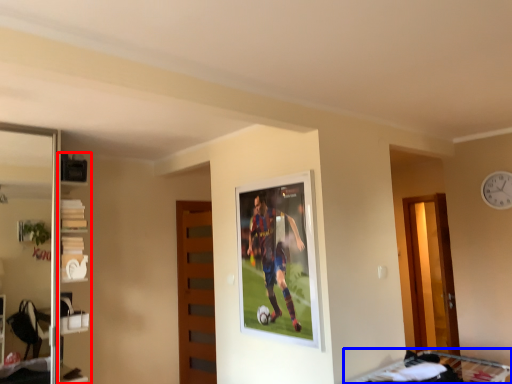
Question: Which point is closer to the camera, shelf (highlighted by a red box) or bunk bed (highlighted by a blue box)?

Choices:
 (A) shelf
 (B) bunk bed

Answer: (B)